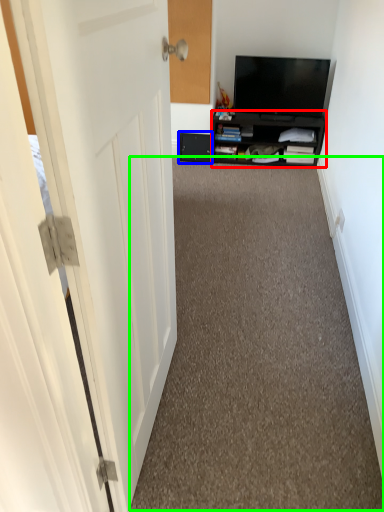
Question: Estimate the real-world distances between objects in this image. Which object is closer to cabinetry (highlighted by a red box), drawer (highlighted by a blue box) or corridor (highlighted by a green box)?

Choices:
 (A) drawer
 (B) corridor

Answer: (A)